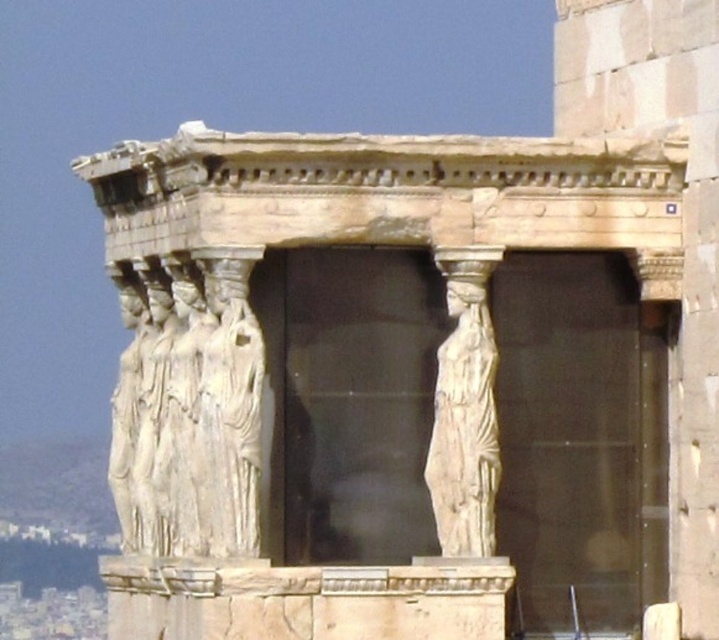
Question: Does white marble statues at center have a larger size compared to white marble statue at center?

Choices:
 (A) yes
 (B) no

Answer: (A)

Question: Is the position of white marble statues at center more distant than that of white marble statue at center?

Choices:
 (A) no
 (B) yes

Answer: (A)

Question: Which point is closer to the camera?

Choices:
 (A) white marble statues at center
 (B) white marble statue at center

Answer: (A)

Question: From the image, what is the correct spatial relationship of white marble statues at center in relation to white marble statue at center?

Choices:
 (A) left
 (B) right

Answer: (A)